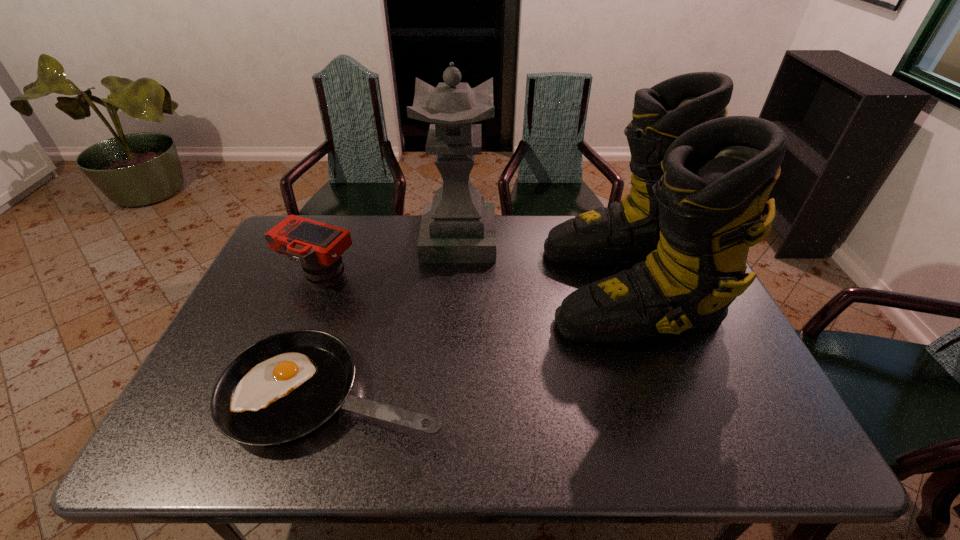
This screenshot has width=960, height=540. What are the coordinates of `camera that is positioned at the far edge` in the screenshot? It's located at 318,247.

This screenshot has height=540, width=960. I want to click on object that is positioned at the near edge, so click(x=283, y=387).

I want to click on camera that is at the left edge, so click(x=318, y=247).

Where is `frying pan present at the left edge`? The image size is (960, 540). frying pan present at the left edge is located at coordinates (283, 387).

Locate an element on the screen. object that is at the right edge is located at coordinates (700, 180).

Image resolution: width=960 pixels, height=540 pixels. What are the coordinates of `object present at the far left corner` in the screenshot? It's located at (318, 247).

The width and height of the screenshot is (960, 540). Identify the location of object positioned at the near left corner. (283, 387).

At what (x,y) coordinates should I click in order to perform the action: click on object at the far right corner. Please return your answer as a coordinate pair (x, y). The width and height of the screenshot is (960, 540). Looking at the image, I should click on (700, 180).

This screenshot has width=960, height=540. I want to click on free space at the far edge, so click(x=537, y=248).

This screenshot has width=960, height=540. In order to click on blank area at the near edge in this screenshot , I will do `click(463, 448)`.